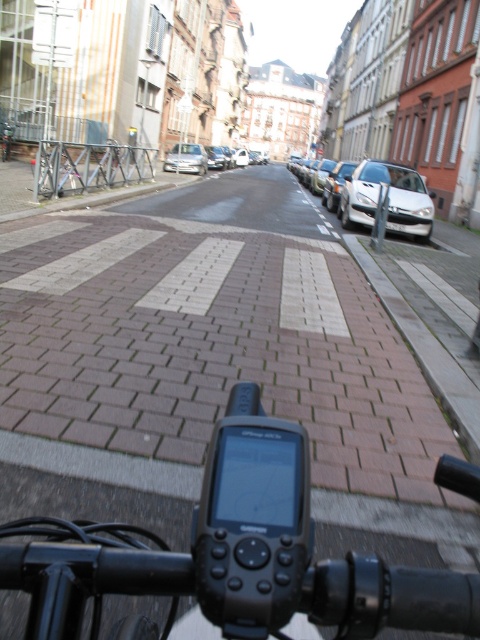
Is point (60, 589) farther from camera compared to point (173, 168)?

No.

Who is more distant from viewer, (294,438) or (181,157)?

Point (181,157)

What are the coordinates of `black plastic gps device at center` in the screenshot? It's located at (240, 554).

Is black plastic gps device at center wider than silver metallic sedan at center?

No, black plastic gps device at center is not wider than silver metallic sedan at center.

Looking at this image, who is positioned more to the right, black plastic gps device at center or silver metallic sedan at center?

From the viewer's perspective, silver metallic sedan at center appears more on the right side.

Which is behind, point (78, 600) or point (336, 166)?

The point (336, 166) is behind.

The height and width of the screenshot is (640, 480). In order to click on black plastic gps device at center in this screenshot , I will do `click(240, 554)`.

Between black plastic gps device at center and metallic silver bicycle at left, which one appears on the right side from the viewer's perspective?

black plastic gps device at center

Who is positioned more to the left, black plastic gps device at center or metallic silver bicycle at left?

From the viewer's perspective, metallic silver bicycle at left appears more on the left side.

Does point (256, 465) lie in front of point (75, 172)?

Yes, point (256, 465) is in front of point (75, 172).

I want to click on black plastic gps device at center, so click(240, 554).